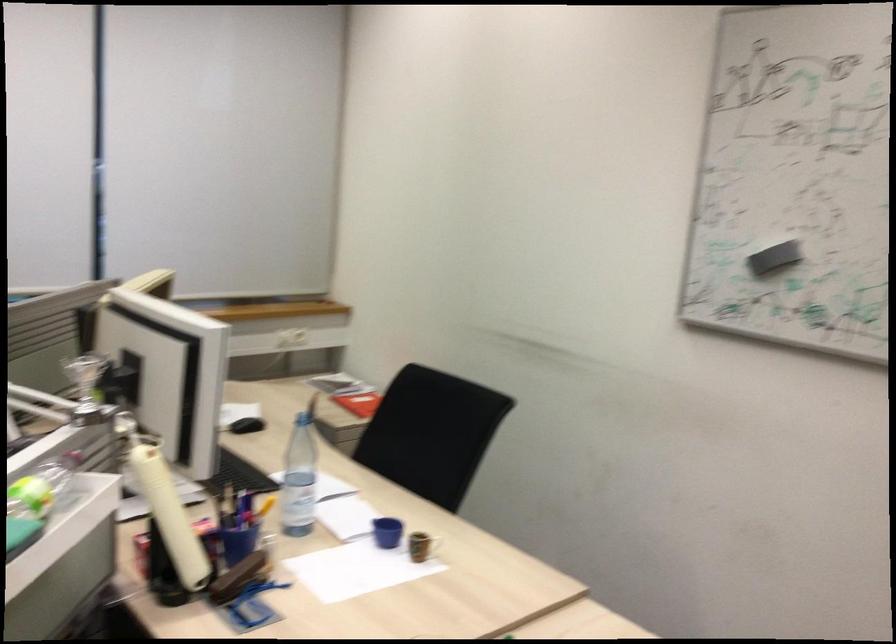
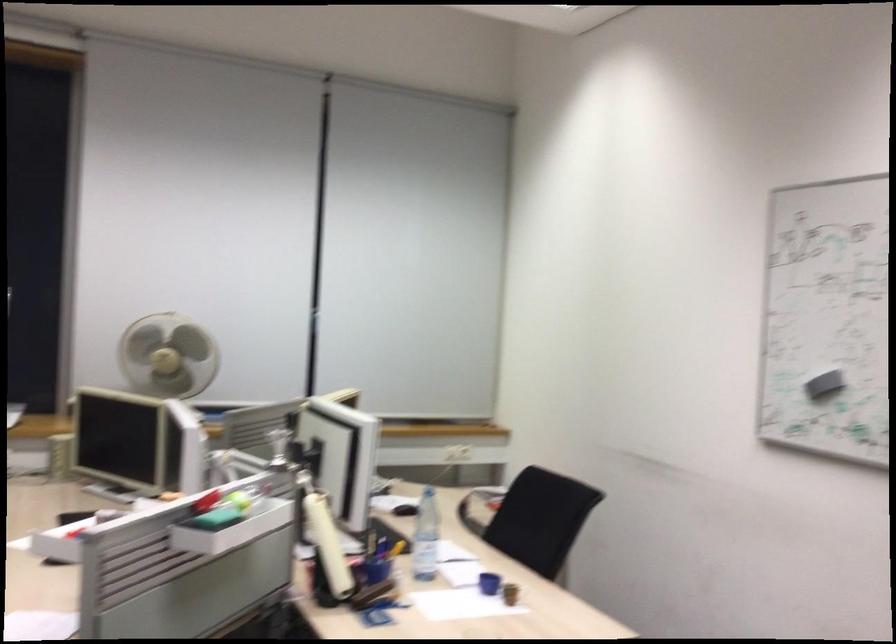
Where in the second image is the point corresponding to (183,512) from the first image?

(328, 545)